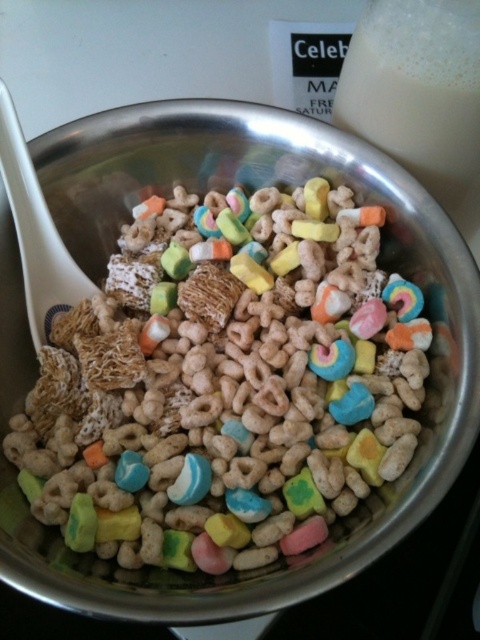
You are a barista preparing a latte and see the image. You need to place the white plastic spoon at left into the cup without touching the white frothy milk at upper right. Is this possible?

Yes, the white frothy milk at upper right is to the right of the white plastic spoon at left, so you can carefully place the spoon into the cup while avoiding the milk by moving it from the left side.

You are a chef preparing a dish and need to know if the colorful cereal at center can be fully submerged in the white frothy milk at upper right. Based on the image, can it be done?

The colorful cereal at center is much taller than the white frothy milk at upper right, so it cannot be fully submerged in the milk.

In the scene shown: You are a chef preparing a dessert and need to determine the position of the white frothy milk at upper right relative to the white plastic spoon at left. Can you tell me which one is higher in the bowl?

The white frothy milk at upper right is above the white plastic spoon at left, so the white frothy milk at upper right is higher in the bowl.